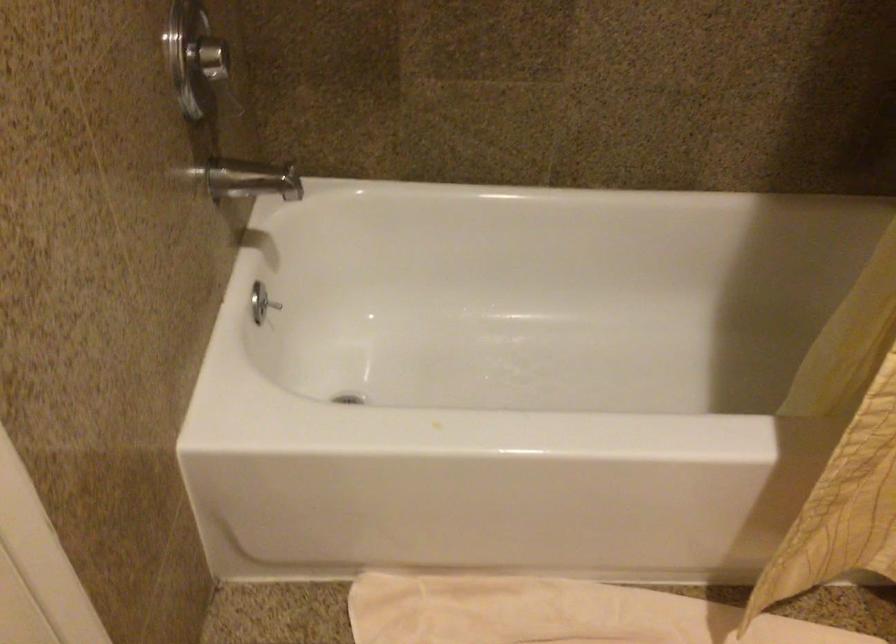
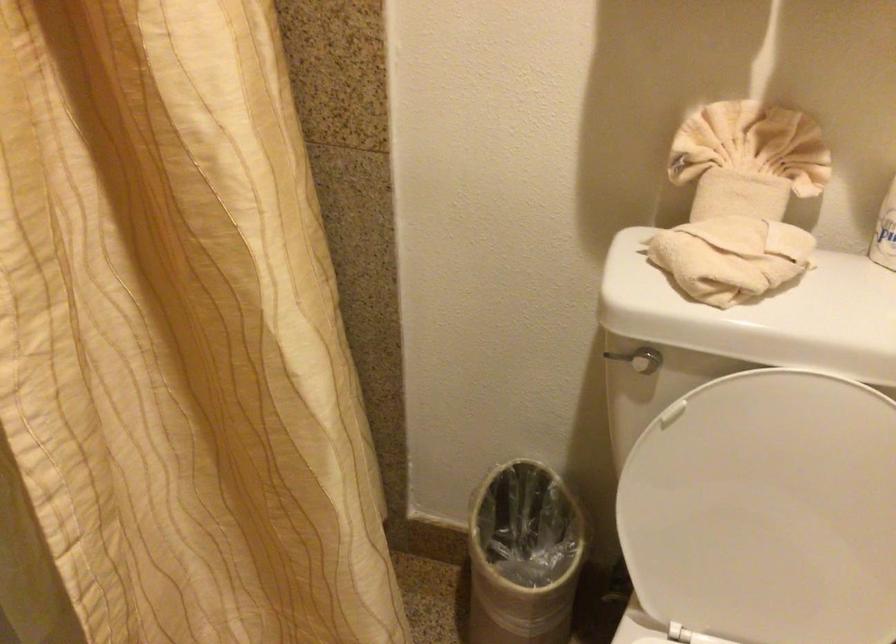
Question: The camera is either moving clockwise (left) or counter-clockwise (right) around the object. The first image is from the beginning of the video and the second image is from the end. Is the camera moving left or right when shooting the video?

Choices:
 (A) Left
 (B) Right

Answer: (A)